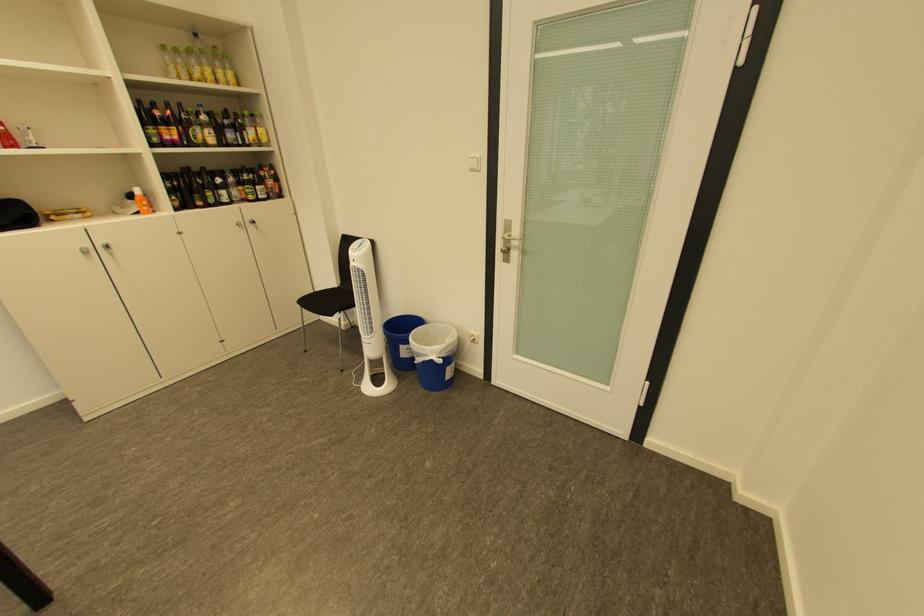
The location [369,318] corresponds to which object?

This point indicates the white tower fan.